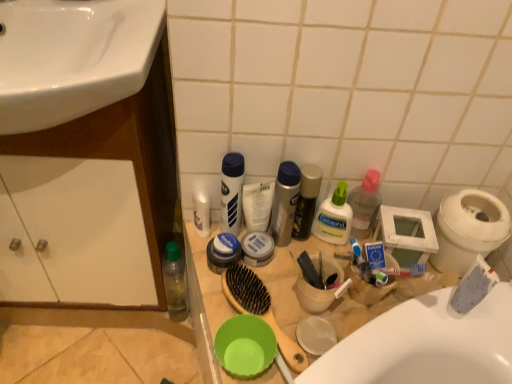
Locate an element on the screen. The image size is (512, 384). space that is in front of matte white cream container at center, acting as the fourth toiletry starting from the left is located at coordinates (265, 306).